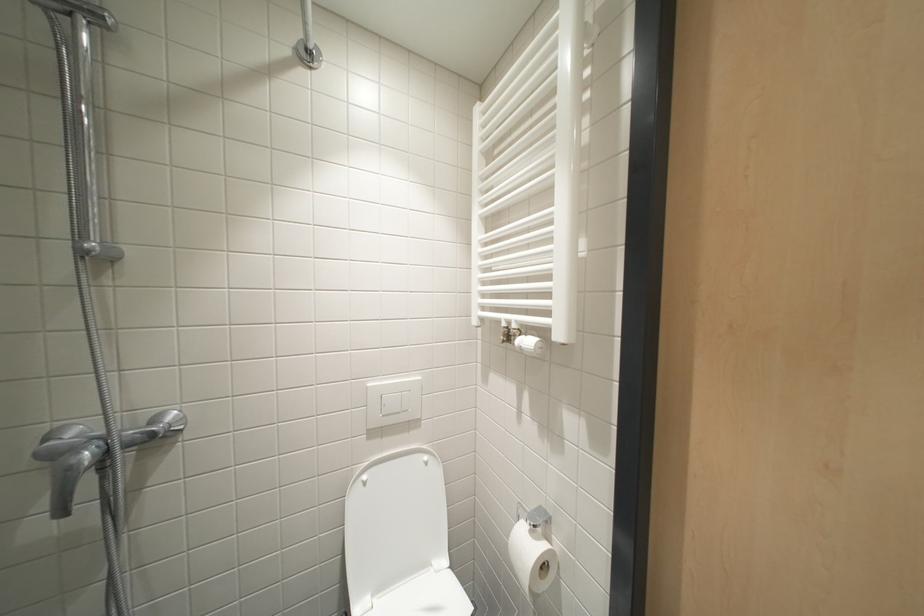
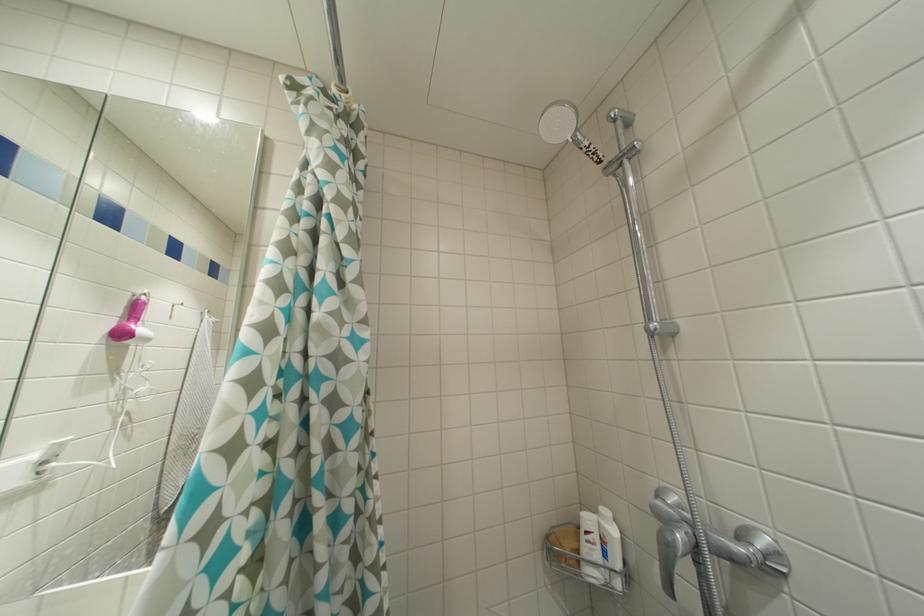
Question: Based on the continuous images, in which direction is the camera rotating? Reply with the corresponding letter.

Choices:
 (A) Left
 (B) Right
 (C) Up
 (D) Down

Answer: (A)